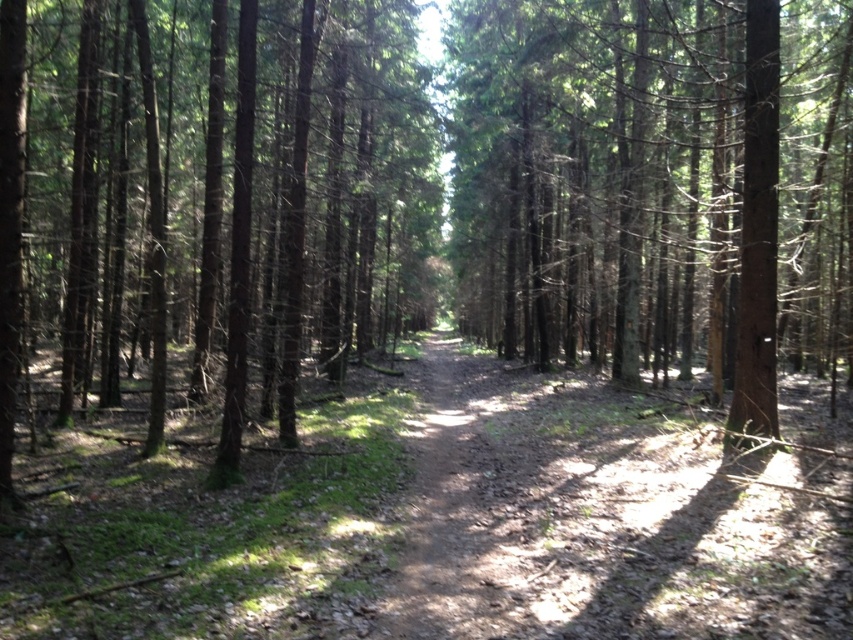
You are standing at the edge of a forest and see the brown dirt track at center and the brown wood tree at center. Which object is closer to you?

The brown dirt track at center is closer to you because it is in front of the brown wood tree at center.